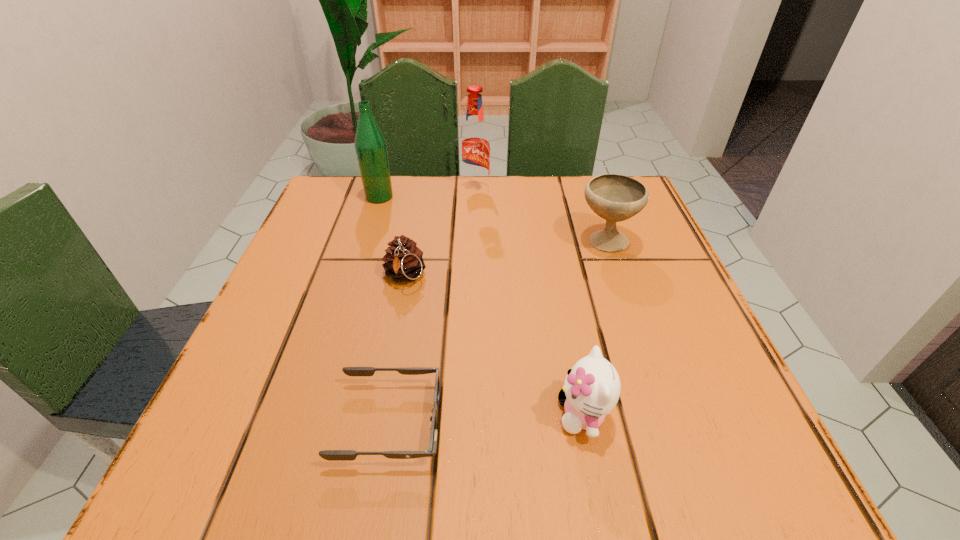
At what (x,y) coordinates should I click in order to perform the action: click on free space between the leftmost object and the third nearest object. Please return your answer as a coordinate pair (x, y). Looking at the image, I should click on (392, 237).

Identify which object is located as the third nearest to the fourth nearest object. Please provide its 2D coordinates. Your answer should be formatted as a tuple, i.e. [(x, y)], where the tuple contains the x and y coordinates of a point satisfying the conditions above.

[(403, 261)]

Choose which object is the fifth nearest neighbor to the third object from right to left. Please provide its 2D coordinates. Your answer should be formatted as a tuple, i.e. [(x, y)], where the tuple contains the x and y coordinates of a point satisfying the conditions above.

[(592, 387)]

At what (x,y) coordinates should I click in order to perform the action: click on free space that satisfies the following two spatial constraints: 1. on the back side of the fourth object from left to right; 2. on the right side of the leftmost object. Please return your answer as a coordinate pair (x, y). Looking at the image, I should click on (381, 191).

The width and height of the screenshot is (960, 540). I want to click on vacant region that satisfies the following two spatial constraints: 1. on the front side of the third farthest object; 2. on the temples of the sunglasses, so click(668, 423).

Where is `vacant point that satisfies the following two spatial constraints: 1. on the front side of the third object from right to left; 2. on the temples of the sunglasses`? This screenshot has width=960, height=540. vacant point that satisfies the following two spatial constraints: 1. on the front side of the third object from right to left; 2. on the temples of the sunglasses is located at coordinates (472, 423).